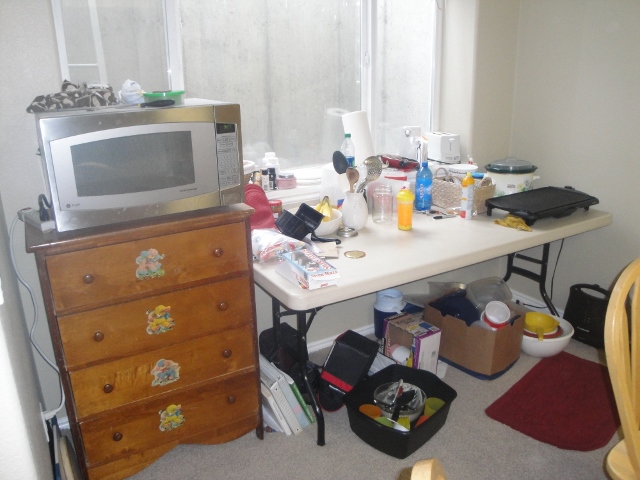
Where is `wall outlet`? Image resolution: width=640 pixels, height=480 pixels. wall outlet is located at coordinates (43, 419).